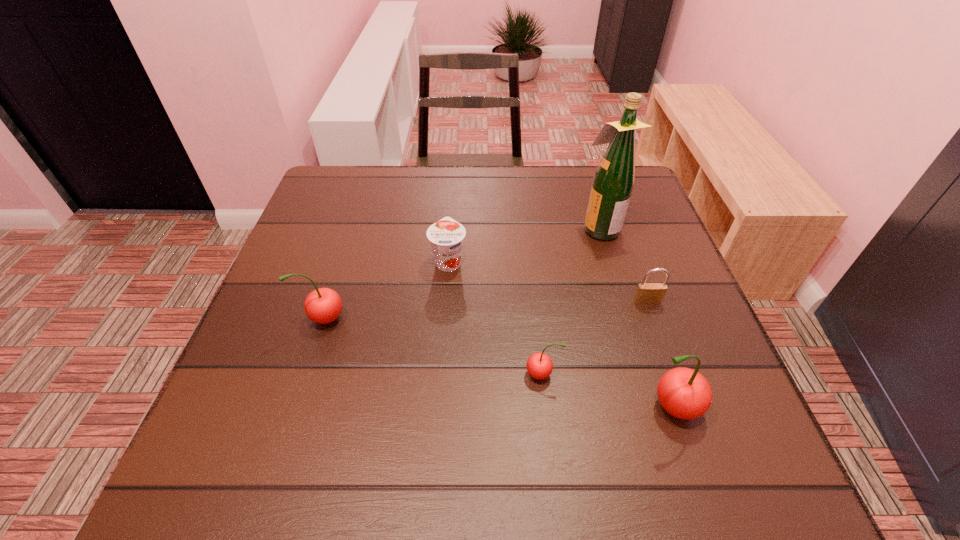
The width and height of the screenshot is (960, 540). What are the coordinates of `vacant point at the near right corner` in the screenshot? It's located at (649, 392).

Locate an element on the screen. free space between the nearest object and the yogurt is located at coordinates (559, 334).

Where is `vacant region between the yogurt and the padlock`? Image resolution: width=960 pixels, height=540 pixels. vacant region between the yogurt and the padlock is located at coordinates (548, 281).

Where is `blank region between the second nearest object and the second tallest cherry`? This screenshot has height=540, width=960. blank region between the second nearest object and the second tallest cherry is located at coordinates (434, 346).

Find the location of a particular element. blank region between the farthest object and the farthest cherry is located at coordinates (462, 273).

Where is `vacant area that lies between the third farthest object and the second shortest cherry`? This screenshot has width=960, height=540. vacant area that lies between the third farthest object and the second shortest cherry is located at coordinates (486, 310).

What are the coordinates of `free space between the second nearest cherry and the third farthest object` in the screenshot? It's located at (594, 338).

This screenshot has height=540, width=960. I want to click on free spot between the farthest cherry and the tallest object, so click(x=462, y=273).

Image resolution: width=960 pixels, height=540 pixels. I want to click on free space between the second farthest object and the liquor, so click(524, 245).

Locate an element on the screen. This screenshot has height=540, width=960. free spot between the second farthest object and the rightmost cherry is located at coordinates (559, 334).